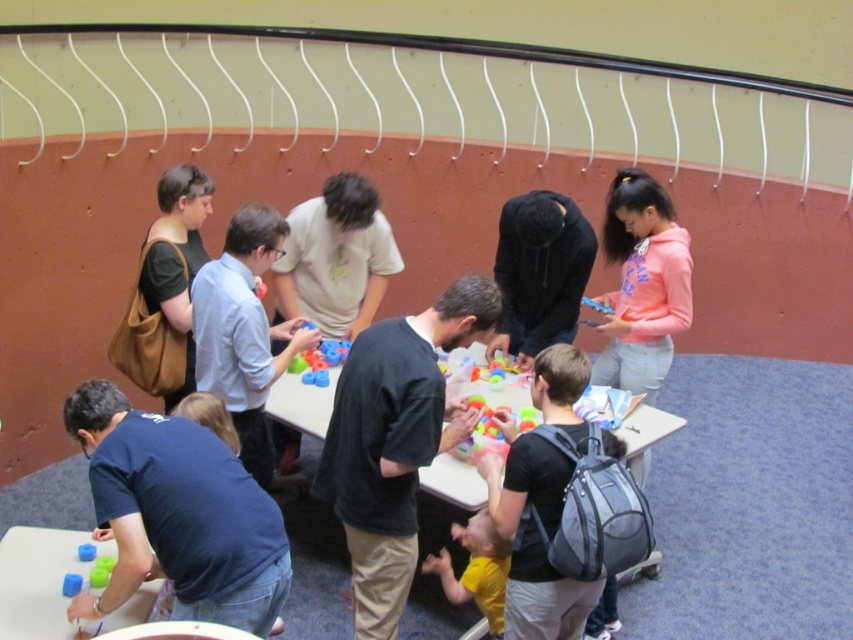
You are a participant in an activity and need to pick up the smooth plastic toy at lower left and the blue plastic cup at lower left. Which object should you reach for first to avoid obstructing your view of the other?

You should reach for the smooth plastic toy at lower left first since it is closer to you, allowing you to pick it up without blocking your view of the blue plastic cup at lower left which is further away.

You are standing in the room and want to find the matte black shirt at upper left. Where should you look?

You should look at point (x=175, y=260) to find the matte black shirt at upper left.

You are a photographer standing at the back of the room. You want to take a photo of both the dark blue shirt at lower left and the black matte hoodie at center. Which person should you adjust your camera angle to focus on first to ensure both are in frame?

The dark blue shirt at lower left is positioned under the black matte hoodie at center, so you should focus on the black matte hoodie at center first to ensure both are visible in the frame.